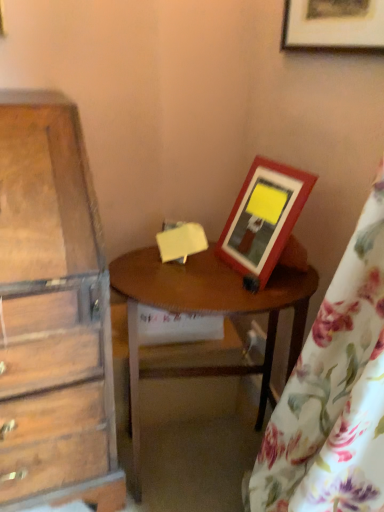
Question: Is wooden picture frame at upper right, marked as the 1th picture frame in a bottom-to-top arrangement, situated inside wooden table at center or outside?

Choices:
 (A) outside
 (B) inside

Answer: (A)

Question: Considering the positions of point (244, 232) and point (144, 279), is point (244, 232) closer or farther from the camera than point (144, 279)?

Choices:
 (A) farther
 (B) closer

Answer: (A)

Question: Estimate the real-world distances between objects in this image. Which object is closer to the wooden picture frame at upper right, the first picture frame positioned from the top?

Choices:
 (A) wooden picture frame at upper right, marked as the 1th picture frame in a bottom-to-top arrangement
 (B) wooden table at center
 (C) floral fabric curtain at right

Answer: (A)

Question: Which object is the farthest from the wooden picture frame at upper right, marked as the 1th picture frame in a bottom-to-top arrangement?

Choices:
 (A) wooden table at center
 (B) wooden picture frame at upper right, the second picture frame positioned from the bottom
 (C) floral fabric curtain at right

Answer: (B)